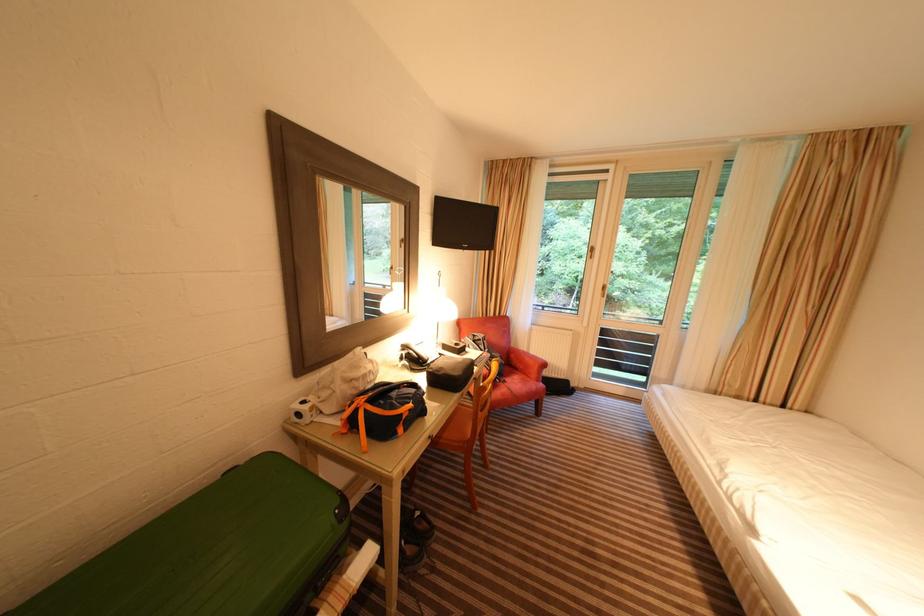
Where is `green suitcase handle`? This screenshot has width=924, height=616. green suitcase handle is located at coordinates tap(216, 552).